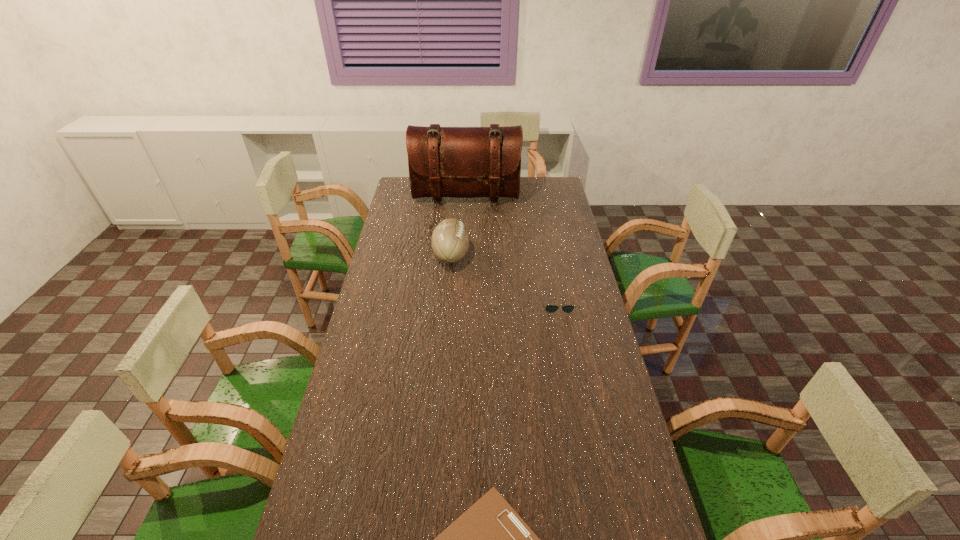
Find the location of `free space that satisfies the following two spatial constraints: 1. on the front-facing side of the farthest object; 2. on the laces of the third nearest object`. free space that satisfies the following two spatial constraints: 1. on the front-facing side of the farthest object; 2. on the laces of the third nearest object is located at coordinates (464, 255).